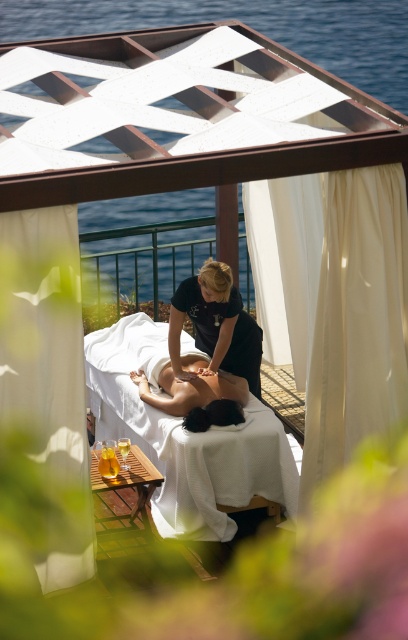
You are a photographer taking a picture of the black smooth uniform at center and the smooth skin at center. Which object should you focus on first if you want to capture both clearly in the same frame?

The black smooth uniform at center is larger in size than smooth skin at center, so you should focus on the black smooth uniform at center first to ensure both are in focus.

You are standing at the edge of the spa area and want to take a photo of the massage table. Which of the two points, point (90, 531) or point (243, 356), will appear closer to the camera in your photo?

Point (90, 531) is closer to the camera than point (243, 356), so it will appear closer in the photo.